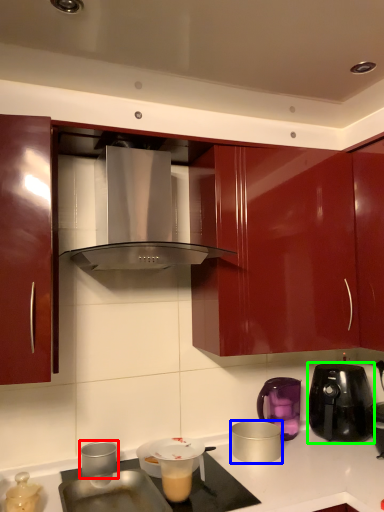
Question: Estimate the real-world distances between objects in this image. Which object is farther from kitchen appliance (highlighted by a red box), kitchen appliance (highlighted by a blue box) or kitchen appliance (highlighted by a green box)?

Choices:
 (A) kitchen appliance
 (B) kitchen appliance

Answer: (B)